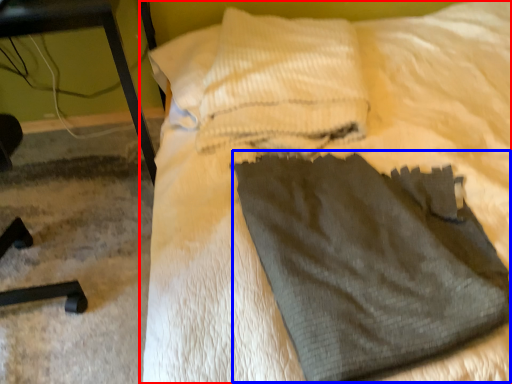
Question: Which object is further to the camera taking this photo, bed (highlighted by a red box) or sweat pant (highlighted by a blue box)?

Choices:
 (A) bed
 (B) sweat pant

Answer: (B)